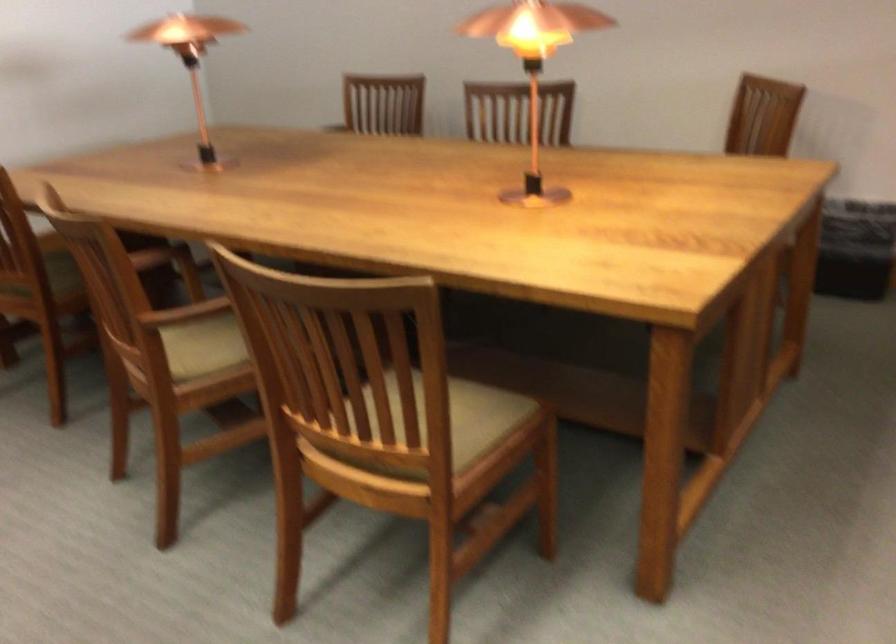
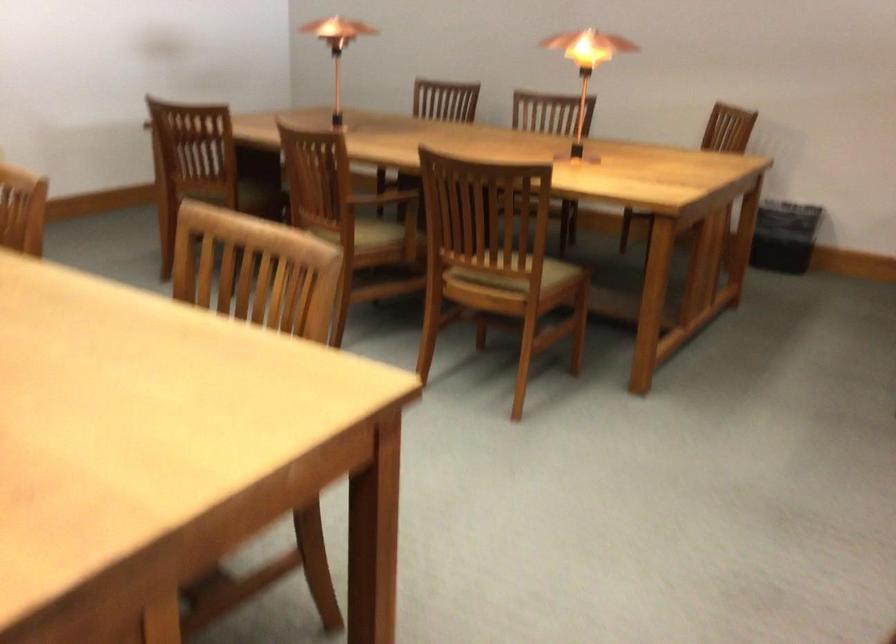
In a continuous first-person perspective shot, in which direction is the camera moving?

The cameraman moved toward left, backward.